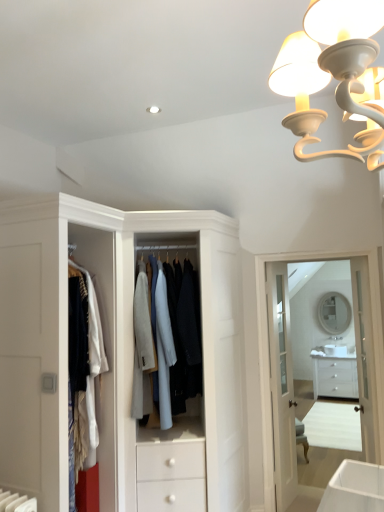
Question: Is white glossy medicine cabinet at upper center taller or shorter than light blue fabric coat at center?

Choices:
 (A) short
 (B) tall

Answer: (B)

Question: From the image's perspective, is white glossy medicine cabinet at upper center positioned above or below light blue fabric coat at center?

Choices:
 (A) below
 (B) above

Answer: (A)

Question: Which is farther from the matte white mirror at center?

Choices:
 (A) white glossy medicine cabinet at upper center
 (B) white glass door at center, the second door when ordered from left to right
 (C) light blue fabric coat at center
 (D) white glossy door at center, the 2th door when ordered from right to left
 (E) white glossy chest of drawers at lower right

Answer: (C)

Question: Estimate the real-world distances between objects in this image. Which object is closer to the white glass door at center, the 1th door from the right?

Choices:
 (A) matte white mirror at center
 (B) white glossy medicine cabinet at upper center
 (C) white glossy door at center, the 2th door when ordered from right to left
 (D) white glossy chest of drawers at lower right
 (E) light blue fabric coat at center

Answer: (B)